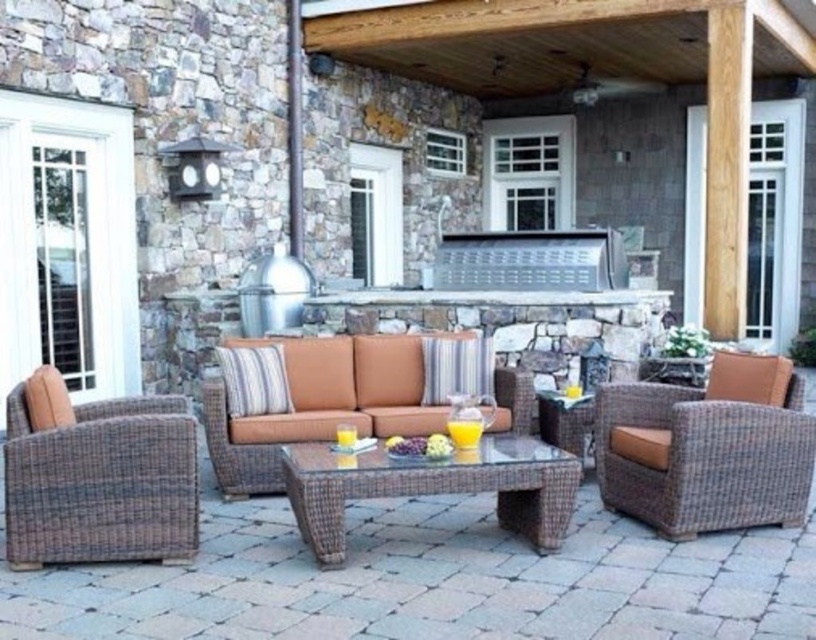
You are standing at the entrance of the patio and want to place a new potted plant exactly at the center of the patio. The current brown wicker armchair at center is located at coordinates 0.633, 0.391. Can you determine if the armchair is positioned exactly at the center of the patio based on its coordinates?

The brown wicker armchair at center is located at coordinates (318,404). Since the center of the patio would typically be at coordinates (408,320), the armchair is slightly to the right and above the true center point.

You are planning to place a large potted plant between the brown wicker armchair at right and the brown wicker armchair at center. According to the scene description, which armchair is located above the other, and where should you position the plant to ensure it is between them?

The brown wicker armchair at center is above the brown wicker armchair at right. To place the plant between them, position it below the center armchair and above the right armchair.

You are planning to place a decorative plant stand exactly between the brown wicker armchair at center and the brown wicker coffee table at center. Based on their positions, which side of the coffee table should the plant stand be placed on?

The brown wicker armchair at center is to the left of the brown wicker coffee table at center, so the plant stand should be placed on the right side of the coffee table to be centered between them.